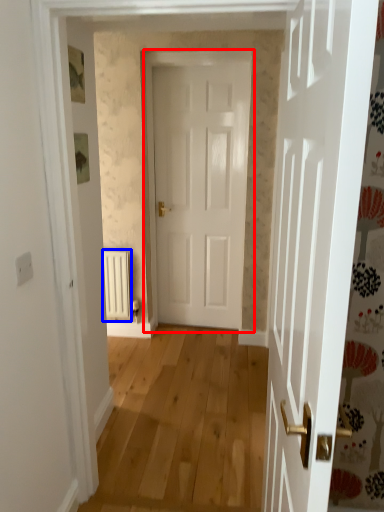
Question: Which object is further to the camera taking this photo, door (highlighted by a red box) or radiator (highlighted by a blue box)?

Choices:
 (A) door
 (B) radiator

Answer: (B)